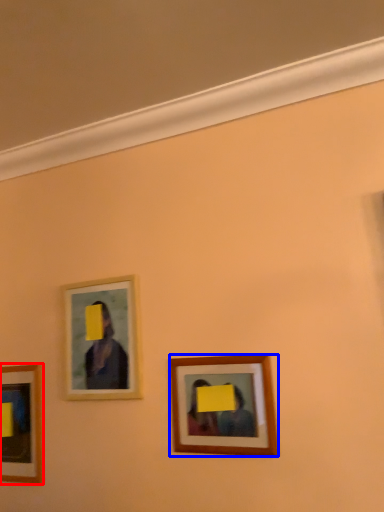
Question: Which object is further to the camera taking this photo, picture frame (highlighted by a red box) or picture frame (highlighted by a blue box)?

Choices:
 (A) picture frame
 (B) picture frame

Answer: (A)